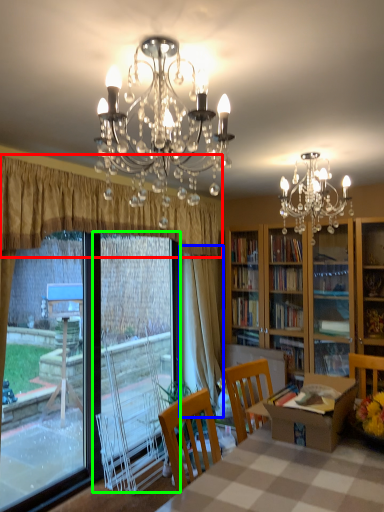
Question: Which object is positioned farthest from curtain (highlighted by a red box)? Select from curtain (highlighted by a blue box) and screen door (highlighted by a green box).

Choices:
 (A) curtain
 (B) screen door

Answer: (B)